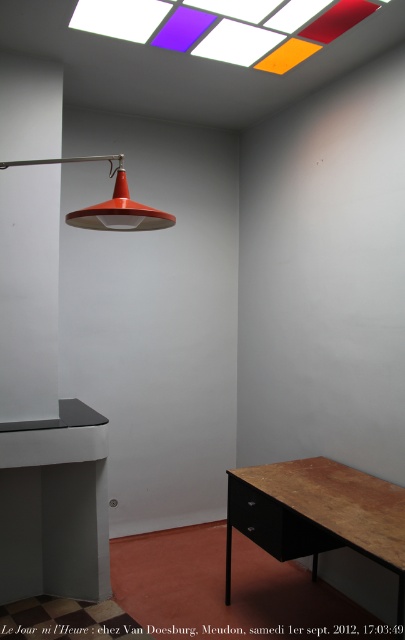
Question: Which of the following is the farthest from the observer?

Choices:
 (A) translucent glass window at upper center
 (B) wooden desk at lower right
 (C) matte orange lampshade at upper center

Answer: (A)

Question: Which of these objects is positioned farthest from the matte orange lampshade at upper center?

Choices:
 (A) translucent glass window at upper center
 (B) wooden desk at lower right

Answer: (B)

Question: Can you confirm if wooden desk at lower right is wider than translucent glass window at upper center?

Choices:
 (A) yes
 (B) no

Answer: (B)

Question: Which point is closer to the camera?

Choices:
 (A) (119, 164)
 (B) (274, 3)
 (C) (340, 499)

Answer: (A)

Question: Does wooden desk at lower right appear under translucent glass window at upper center?

Choices:
 (A) yes
 (B) no

Answer: (A)

Question: Can you confirm if wooden desk at lower right is bigger than matte orange lampshade at upper center?

Choices:
 (A) yes
 (B) no

Answer: (B)